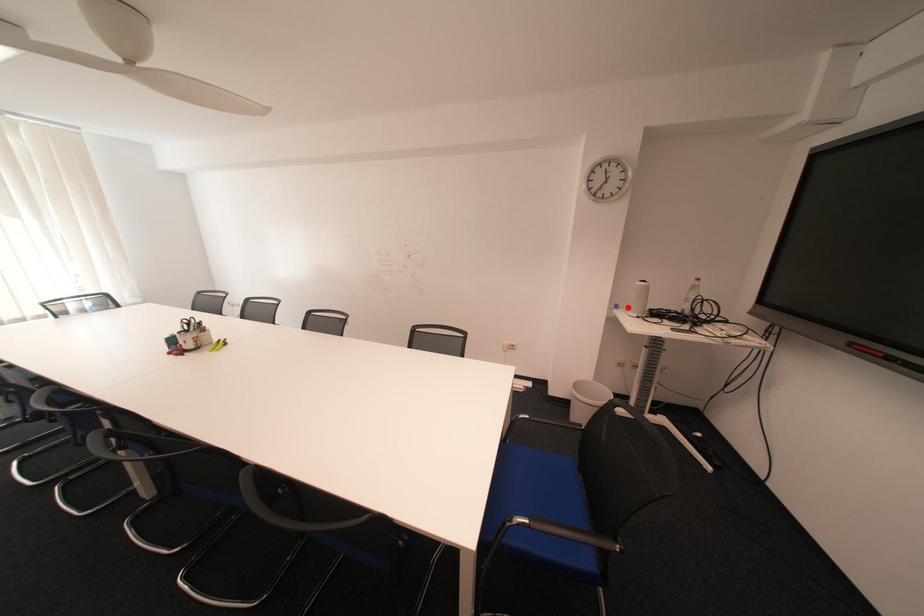
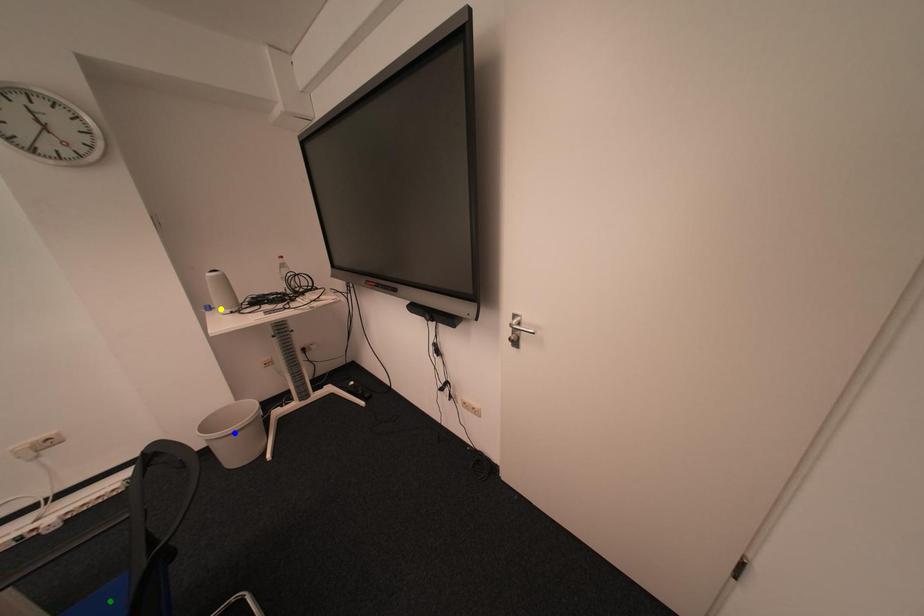
Question: I am providing you with two images of the same scene from different viewpoints. A red point is marked on the first image. You are given multiple points on the second image. Which point in image 2 is actually the same real-world point as the red point in image 1?

Choices:
 (A) green point
 (B) blue point
 (C) yellow point

Answer: (C)